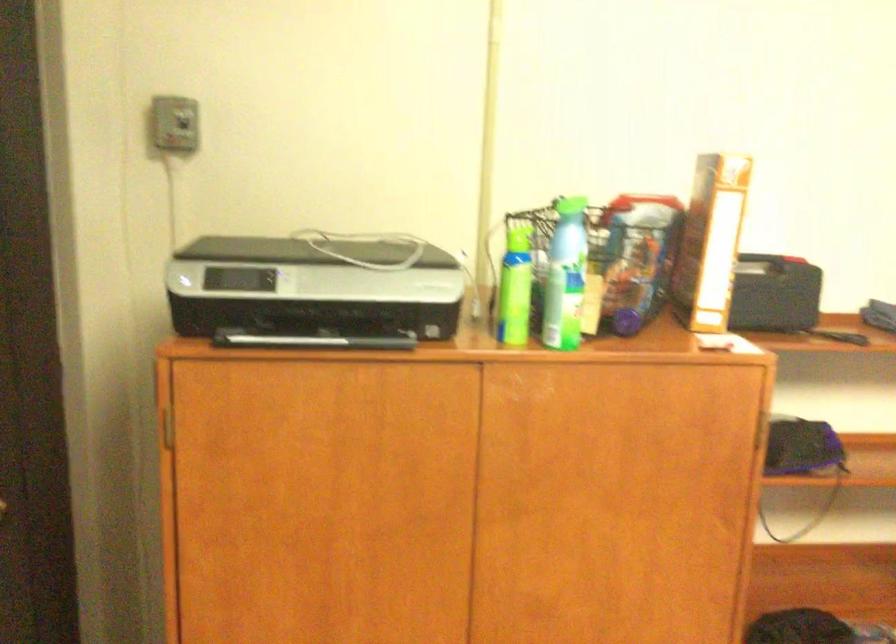
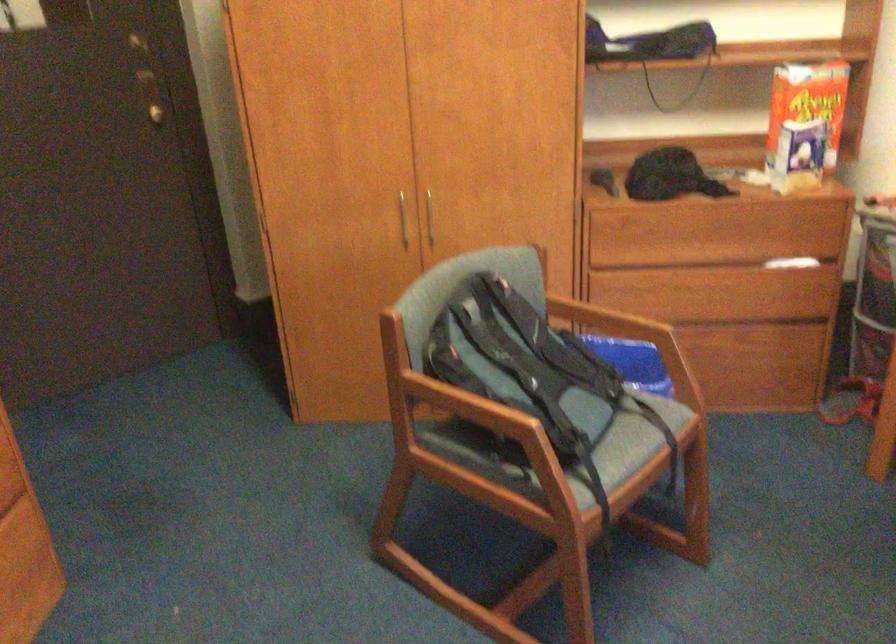
Based on the photo, which direction would the cameraman need to move to produce the second image?

The cameraman walked toward right, backward.